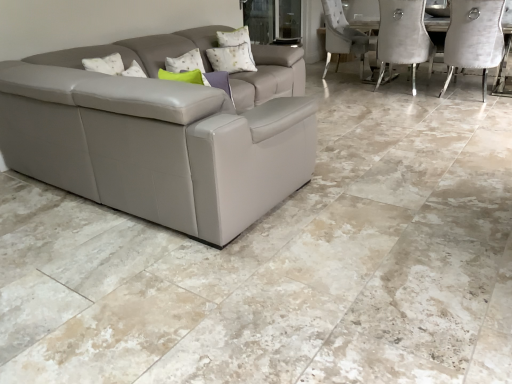
Describe the element at coordinates (474, 38) in the screenshot. This screenshot has width=512, height=384. I see `velvet grey chair at upper right` at that location.

Image resolution: width=512 pixels, height=384 pixels. What do you see at coordinates (273, 21) in the screenshot? I see `transparent glass door at upper center` at bounding box center [273, 21].

In order to click on white textured pillow at upper center in this screenshot , I will do `click(236, 39)`.

Considering the relative positions of transparent glass door at upper center and velvet grey chair at upper right in the image provided, is transparent glass door at upper center to the right of velvet grey chair at upper right from the viewer's perspective?

In fact, transparent glass door at upper center is to the left of velvet grey chair at upper right.

From the image's perspective, who appears lower, transparent glass door at upper center or velvet grey chair at upper right?

velvet grey chair at upper right.

Are transparent glass door at upper center and velvet grey chair at upper right far apart?

Yes, transparent glass door at upper center and velvet grey chair at upper right are quite far apart.

Is white textured pillow at upper center oriented towards transparent glass door at upper center?

No, white textured pillow at upper center does not turn towards transparent glass door at upper center.

Is white textured pillow at upper center inside the boundaries of transparent glass door at upper center, or outside?

white textured pillow at upper center lies outside transparent glass door at upper center.

In the scene shown: Considering the sizes of objects white textured pillow at upper center and transparent glass door at upper center in the image provided, who is wider, white textured pillow at upper center or transparent glass door at upper center?

With larger width is white textured pillow at upper center.

Find the location of `pillow below the transparent glass door at upper center (from the image's perspective)`. pillow below the transparent glass door at upper center (from the image's perspective) is located at coordinates (236, 39).

From the image's perspective, which is above, velvet grey chair at upper right or transparent glass door at upper center?

From the image's view, transparent glass door at upper center is above.

Does velvet grey chair at upper right turn towards transparent glass door at upper center?

No.

From a real-world perspective, which is physically below, velvet grey chair at upper right or transparent glass door at upper center?

velvet grey chair at upper right, from a real-world perspective.

Can you see velvet grey chair at upper right touching transparent glass door at upper center?

velvet grey chair at upper right and transparent glass door at upper center are clearly separated.

Considering the positions of objects velvet grey chair at upper right and white textured pillow at upper center in the image provided, who is more to the left, velvet grey chair at upper right or white textured pillow at upper center?

white textured pillow at upper center.

Can you confirm if velvet grey chair at upper right is shorter than white textured pillow at upper center?

No, velvet grey chair at upper right is not shorter than white textured pillow at upper center.

Which is behind, velvet grey chair at upper right or white textured pillow at upper center?

white textured pillow at upper center is further from the camera.

Between velvet grey chair at upper right and white textured pillow at upper center, which one has smaller size?

Smaller between the two is white textured pillow at upper center.

You are a GUI agent. You are given a task and a screenshot of the screen. Output one action in this format:
    pyautogui.click(x=<x>, y=<y>)
    Task: Click on the pillow that appears on the left of transparent glass door at upper center
    This screenshot has height=384, width=512.
    Given the screenshot: What is the action you would take?
    pyautogui.click(x=236, y=39)

Is the depth of transparent glass door at upper center greater than that of white textured pillow at upper center?

Yes, transparent glass door at upper center is further from the camera.

Does transparent glass door at upper center appear on the left side of white textured pillow at upper center?

No, transparent glass door at upper center is not to the left of white textured pillow at upper center.

In the scene shown: How distant is transparent glass door at upper center from white textured pillow at upper center?

A distance of 1.31 meters exists between transparent glass door at upper center and white textured pillow at upper center.

From a real-world perspective, is white textured pillow at upper center over velvet grey chair at upper right?

Yes.

Considering the relative sizes of white textured pillow at upper center and velvet grey chair at upper right in the image provided, is white textured pillow at upper center shorter than velvet grey chair at upper right?

Indeed, white textured pillow at upper center has a lesser height compared to velvet grey chair at upper right.

Considering the sizes of white textured pillow at upper center and velvet grey chair at upper right in the image, is white textured pillow at upper center wider or thinner than velvet grey chair at upper right?

white textured pillow at upper center is thinner than velvet grey chair at upper right.

Is velvet grey chair at upper right at the back of white textured pillow at upper center?

No, white textured pillow at upper center is not facing away from velvet grey chair at upper right.

This screenshot has width=512, height=384. What are the coordinates of `chair that appears in front of the transparent glass door at upper center` in the screenshot? It's located at (474, 38).

Find the location of a particular element. The image size is (512, 384). glass door above the white textured pillow at upper center (from the image's perspective) is located at coordinates (273, 21).

Looking at the image, which one is located further to transparent glass door at upper center, white textured pillow at upper center or velvet grey chair at upper right?

The object further to transparent glass door at upper center is velvet grey chair at upper right.

Based on their spatial positions, is transparent glass door at upper center or velvet grey chair at upper right further from white textured pillow at upper center?

Based on the image, velvet grey chair at upper right appears to be further to white textured pillow at upper center.

Which object lies nearer to the anchor point velvet grey chair at upper right, white textured pillow at upper center or transparent glass door at upper center?

transparent glass door at upper center.

Looking at this image, based on their spatial positions, is transparent glass door at upper center or white textured pillow at upper center closer to velvet grey chair at upper right?

transparent glass door at upper center lies closer to velvet grey chair at upper right than the other object.

Based on their spatial positions, is velvet grey chair at upper right or white textured pillow at upper center closer to transparent glass door at upper center?

Among the two, white textured pillow at upper center is located nearer to transparent glass door at upper center.

Which object lies nearer to the anchor point white textured pillow at upper center, velvet grey chair at upper right or transparent glass door at upper center?

transparent glass door at upper center lies closer to white textured pillow at upper center than the other object.

Find the location of a particular element. The image size is (512, 384). glass door situated between white textured pillow at upper center and velvet grey chair at upper right from left to right is located at coordinates (273, 21).